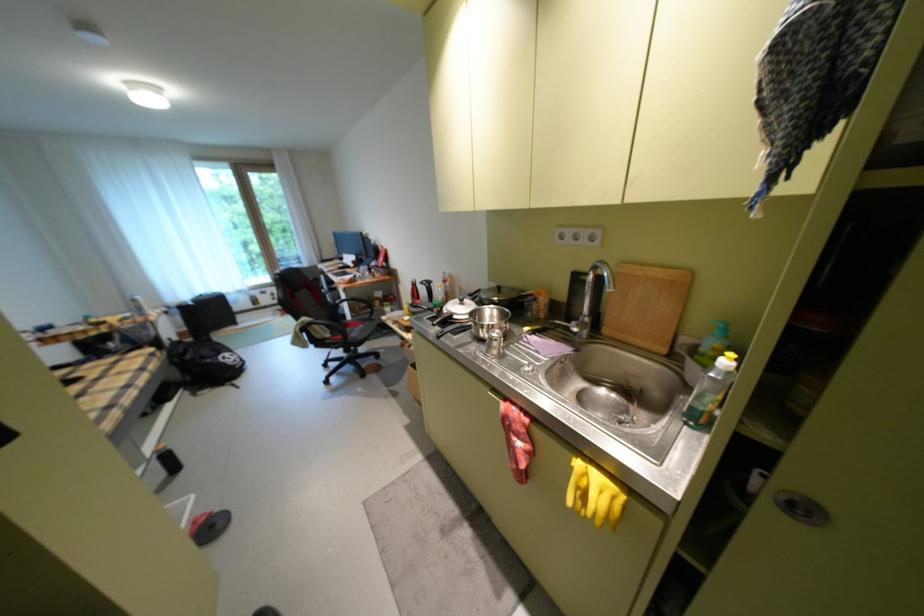
Describe the element at coordinates (590, 294) in the screenshot. The height and width of the screenshot is (616, 924). I see `a faucet handle` at that location.